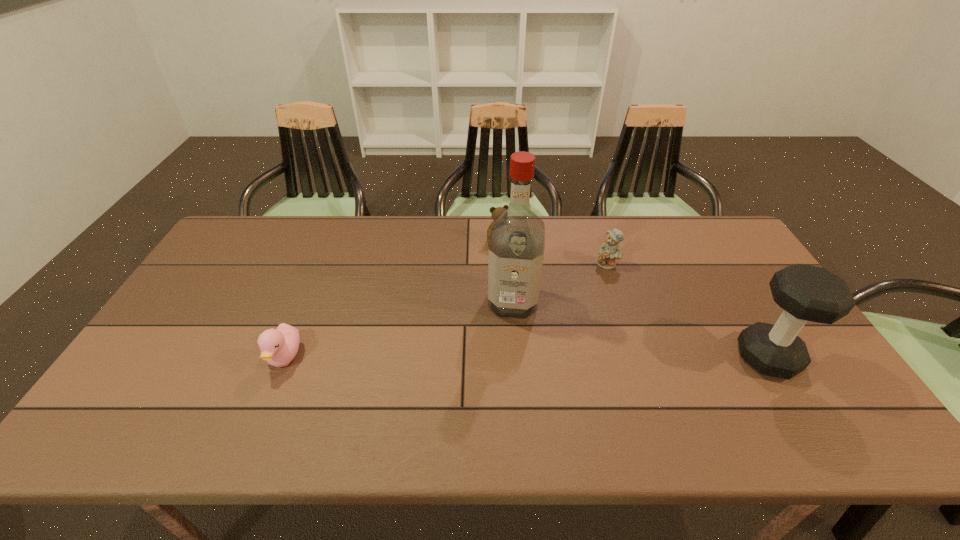
Locate an element on the screen. This screenshot has width=960, height=540. vacant space on the desktop that is between the leftmost object and the rightmost object and is positioned on the front-facing side of the farther teddy bear is located at coordinates (561, 357).

Find the location of a particular element. The image size is (960, 540). free space on the desktop that is between the duckling and the fourth shortest object and is positioned on the front-facing side of the right teddy bear is located at coordinates (585, 357).

What are the coordinates of `free space on the desktop that is between the duckling and the second tallest object and is positioned on the front-facing side of the tallest object` in the screenshot? It's located at (508, 357).